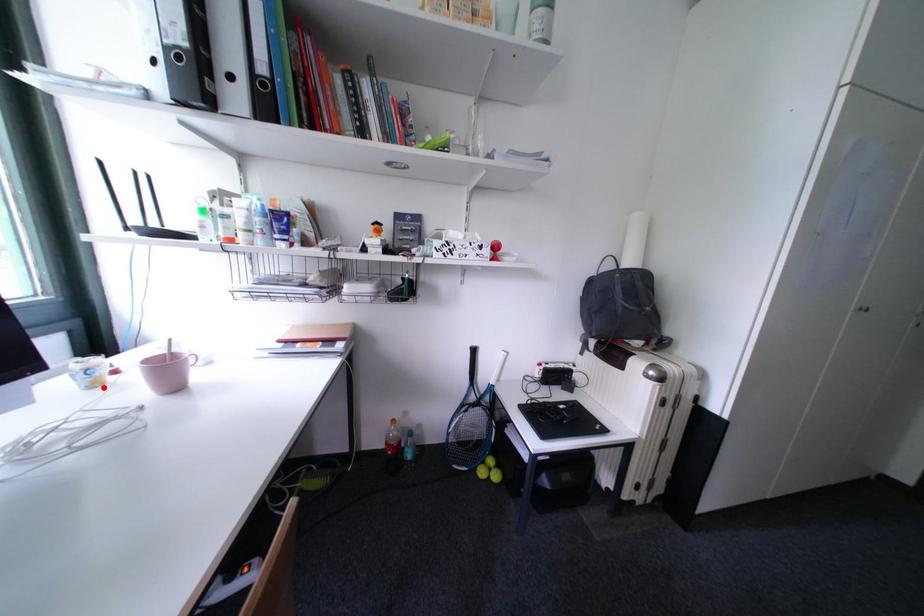
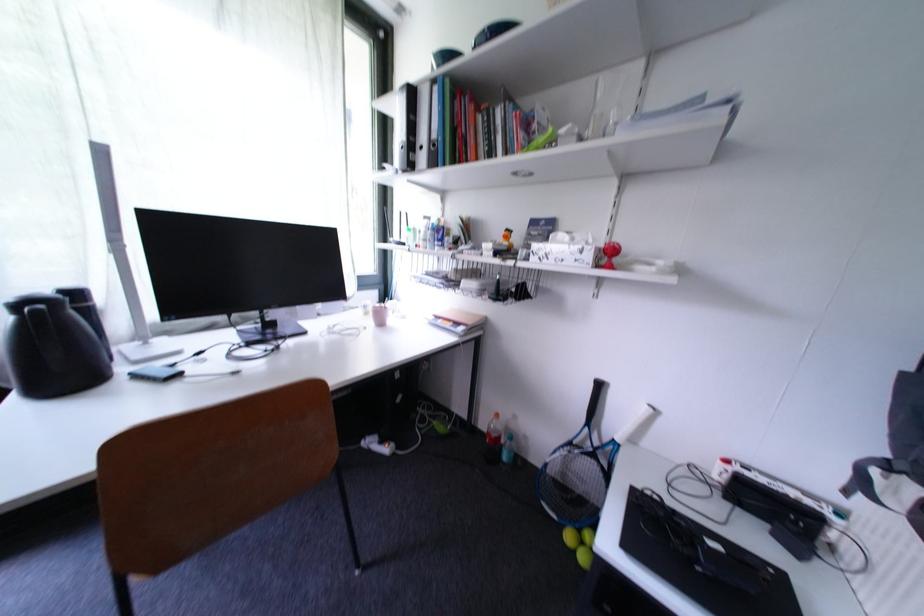
Where in the second image is the point corresponding to the highlighted location from the first image?

(373, 315)